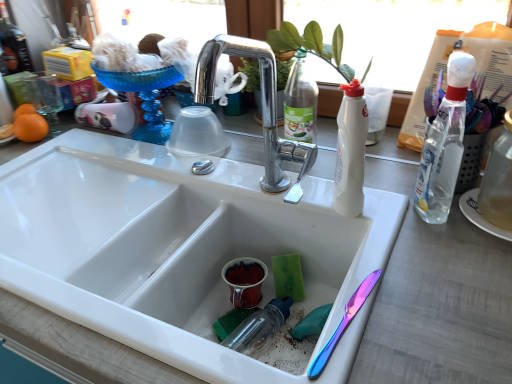
In order to click on vacant space situated on the left part of clear glass bottle at right, which ranks as the third bottle in left-to-right order in this screenshot , I will do `click(415, 237)`.